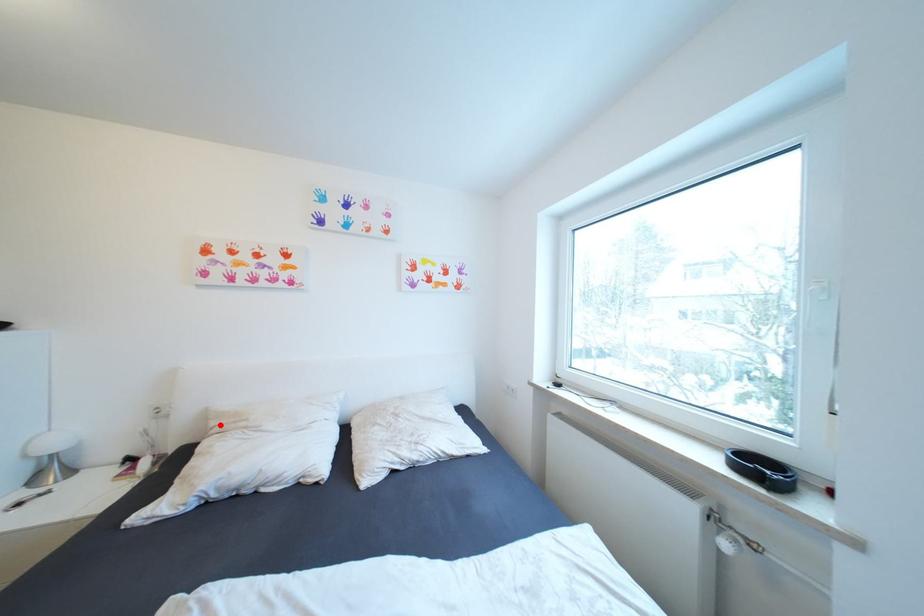
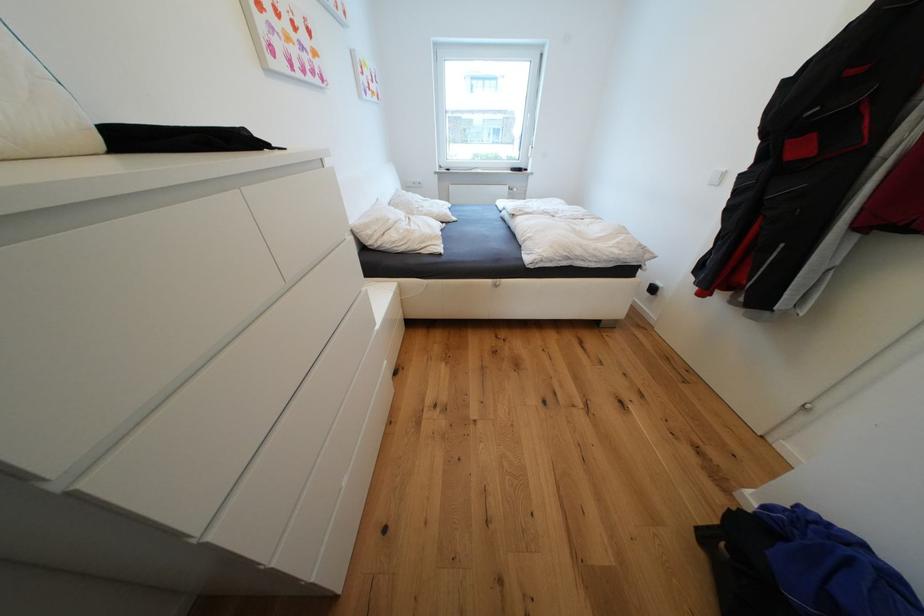
Question: I am providing you with two images of the same scene from different viewpoints. A red point is shown in image1. For the corresponding object point in image2, is it positioned nearer or farther from the camera?

Choices:
 (A) Nearer
 (B) Farther

Answer: (A)